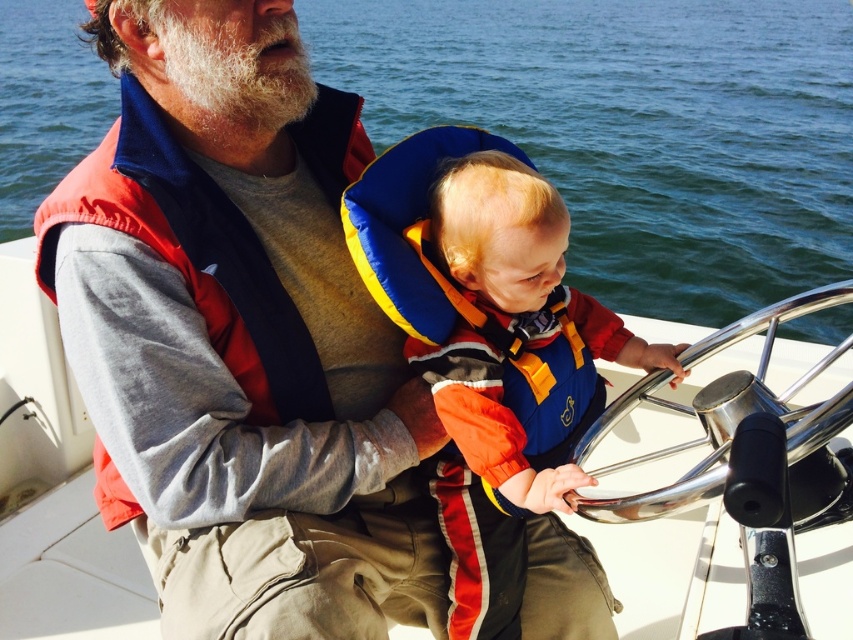
Locate an element on the screen. blue water at center is located at coordinates (635, 129).

Who is lower down, blue water at center or metallic silver boat at center?

metallic silver boat at center

Does point (654, 177) come closer to viewer compared to point (674, 552)?

That is False.

Where is `blue water at center`? blue water at center is located at coordinates (635, 129).

Is metallic silver boat at center above blue/yellow life vest at center?

No, metallic silver boat at center is not above blue/yellow life vest at center.

In order to click on metallic silver boat at center in this screenshot , I will do [55, 488].

This screenshot has width=853, height=640. In order to click on blue water at center in this screenshot , I will do `click(635, 129)`.

Is point (94, 77) more distant than point (497, 179)?

Yes.

You are a GUI agent. You are given a task and a screenshot of the screen. Output one action in this format:
    pyautogui.click(x=<x>, y=<y>)
    Task: Click on the blue water at center
    Image resolution: width=853 pixels, height=640 pixels.
    Given the screenshot: What is the action you would take?
    pyautogui.click(x=635, y=129)